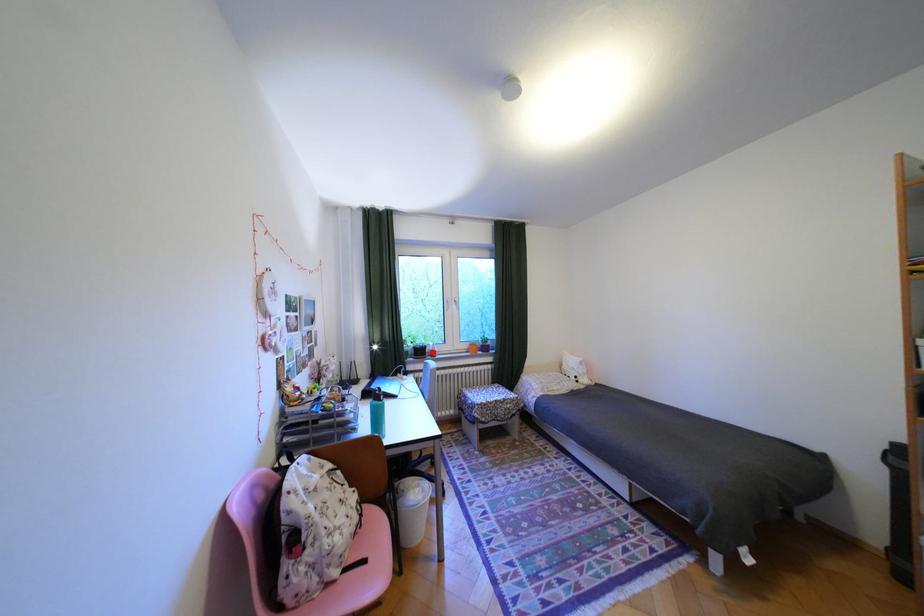
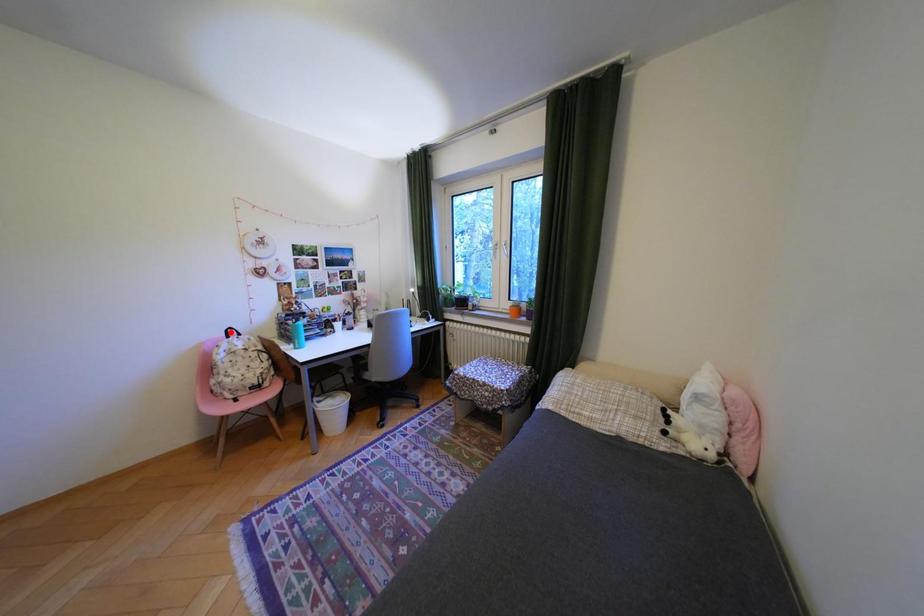
I am providing you with two images of the same scene from different viewpoints. A red point is marked on the first image and another point is marked on the second image. Is the marked point in image1 the same physical position as the marked point in image2?

No